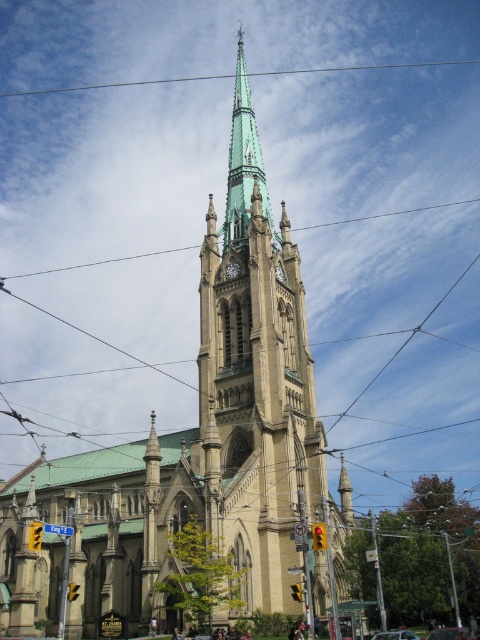
Question: Can you confirm if green glazed steeple at center is positioned to the right of clear wire at upper center?

Choices:
 (A) no
 (B) yes

Answer: (A)

Question: Which of the following is the farthest from the observer?

Choices:
 (A) (286, 228)
 (B) (225, 273)
 (C) (434, 61)

Answer: (C)

Question: From the image, what is the correct spatial relationship of green glazed steeple at center in relation to white stone clock at center?

Choices:
 (A) left
 (B) right

Answer: (B)

Question: Which point appears closest to the camera in this image?

Choices:
 (A) (383, 218)
 (B) (236, 104)

Answer: (B)

Question: Which point is closer to the camera?

Choices:
 (A) metallic red car at center
 (B) metallic silver car at center
 (C) green glass spire at center

Answer: (B)

Question: From the image, what is the correct spatial relationship of beige stone church at center in relation to green glazed steeple at center?

Choices:
 (A) right
 (B) left

Answer: (B)